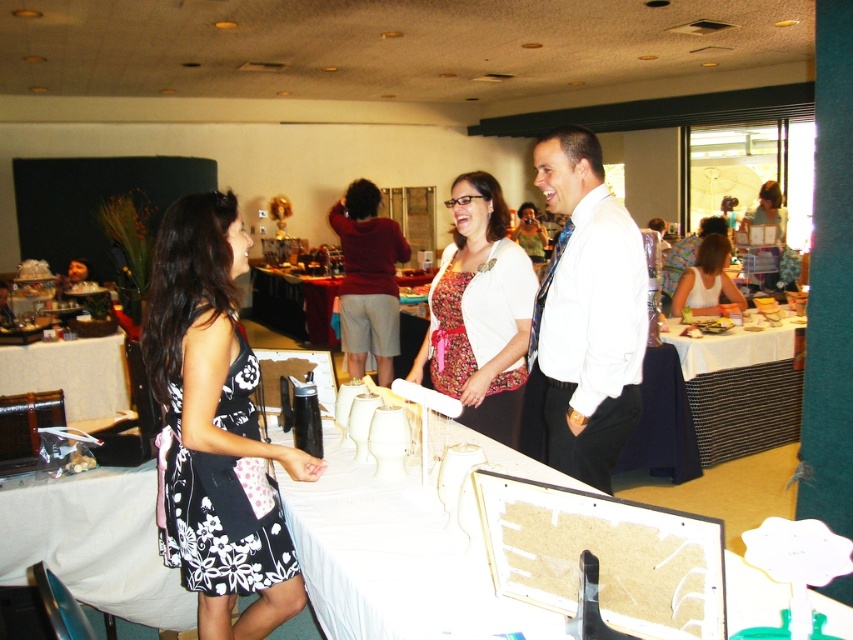
Is white matte blouse at center behind white matte dress at center?

No, white matte blouse at center is in front of white matte dress at center.

Is point (706, 276) positioned in front of point (715, 284)?

Yes, point (706, 276) is closer to viewer.

Which is behind, point (682, 292) or point (717, 285)?

The point (717, 285) is more distant.

Find the location of a particular element. white matte blouse at center is located at coordinates (706, 280).

Who is more distant from viewer, (218, 529) or (320, 326)?

The point (320, 326) is behind.

Can you confirm if floral-patterned fabric dress at left is wider than wooden table at center?

In fact, floral-patterned fabric dress at left might be narrower than wooden table at center.

The image size is (853, 640). I want to click on floral-patterned fabric dress at left, so click(218, 515).

Who is lower down, white shirt at center or white matte dress at center?

white shirt at center is lower down.

Between white shirt at center and white matte dress at center, which one is positioned higher?

white matte dress at center is higher up.

This screenshot has width=853, height=640. Describe the element at coordinates (587, 310) in the screenshot. I see `white shirt at center` at that location.

Identify the location of white shirt at center. (587, 310).